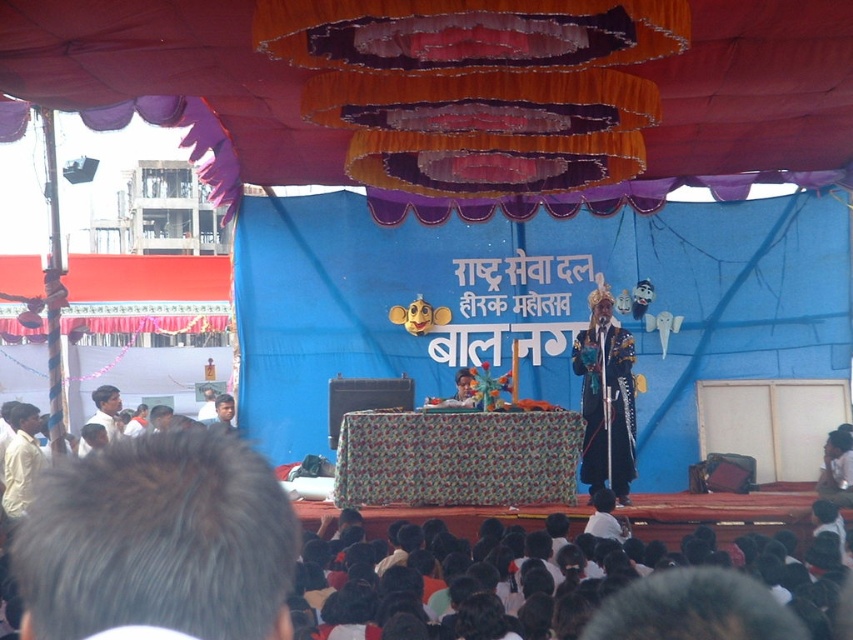
You are an event organizer setting up chairs for attendees. You have a chair that is 50 cm wide. There is a black fabric at lower center and a shiny blue costume at center. Which object should you avoid placing the chair in front of to ensure it doesn not block the view?

The black fabric at lower center is wider than the shiny blue costume at center, so placing the chair in front of the black fabric at lower center may block the view more due to its wider width.

You are attending the event and want to take a photo of both the black fabric at lower center and the shiny blue costume at center. Which object should you focus on first to ensure both are in the frame?

You should focus on the shiny blue costume at center first because the black fabric at lower center is closer to the viewer, so adjusting the camera to include both would require ensuring the closer object is framed appropriately before including the one further away.

You are an event planner setting up a photo booth. You need to decide which object is wider to choose the best backdrop. Which one is wider between the textured fabric canopy at upper center and the shiny blue costume at center?

The textured fabric canopy at upper center is wider than the shiny blue costume at center according to the description.